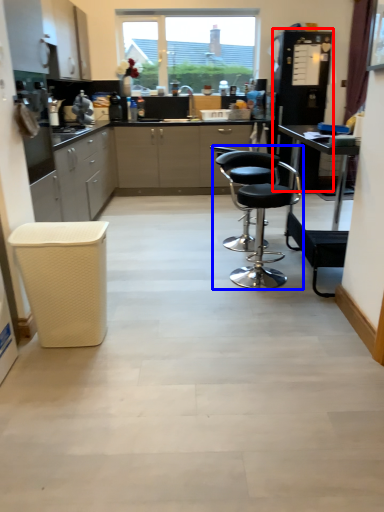
Question: Which point is closer to the camera, appliance (highlighted by a red box) or chair (highlighted by a blue box)?

Choices:
 (A) appliance
 (B) chair

Answer: (B)